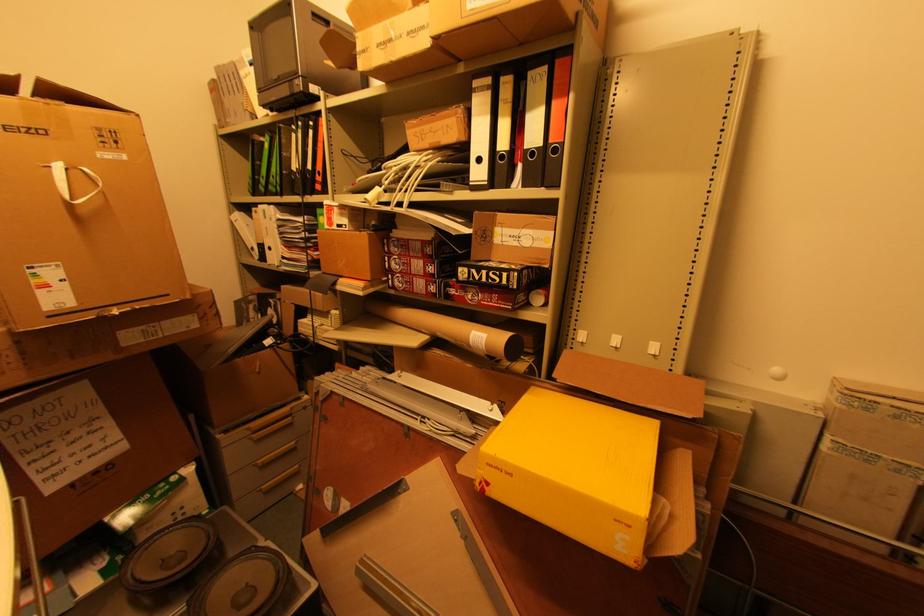
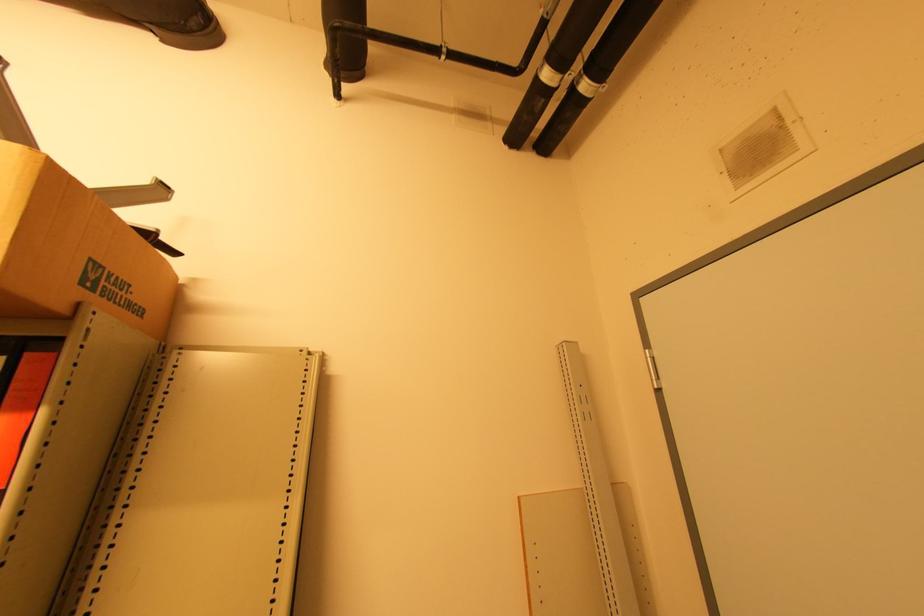
Based on the continuous images, in which direction is the camera rotating?

The camera rotated toward right-up.